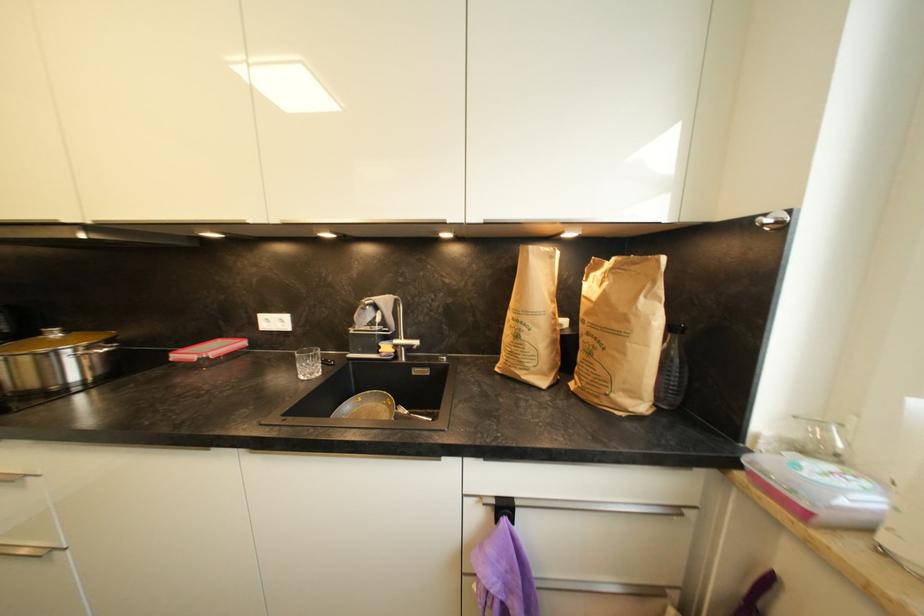
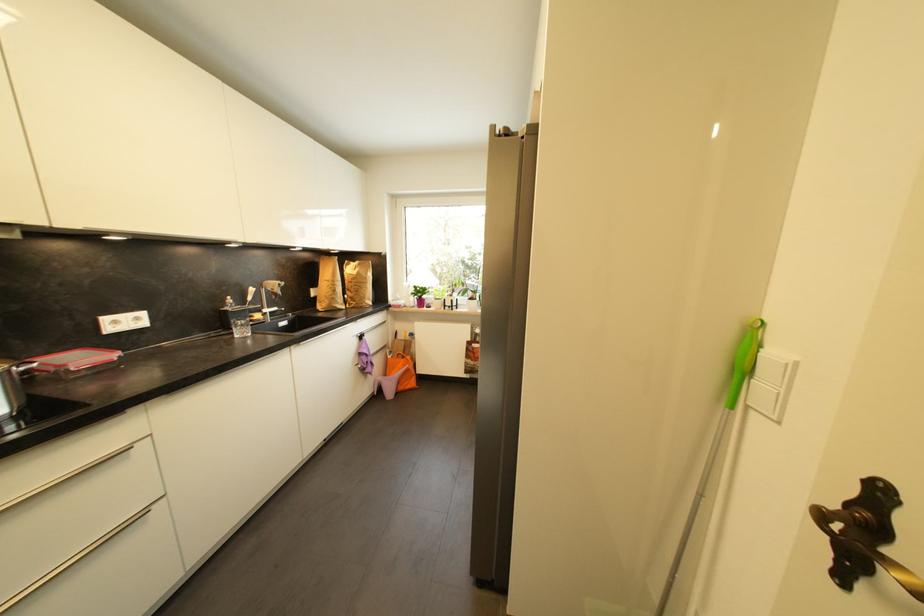
Locate, in the second image, the point that corresponds to point (591, 315) in the first image.

(358, 281)